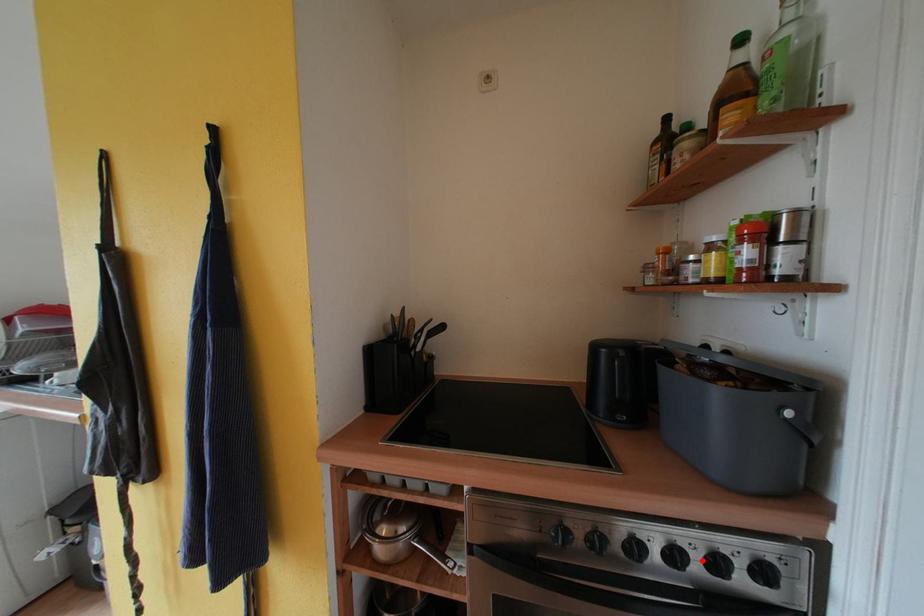
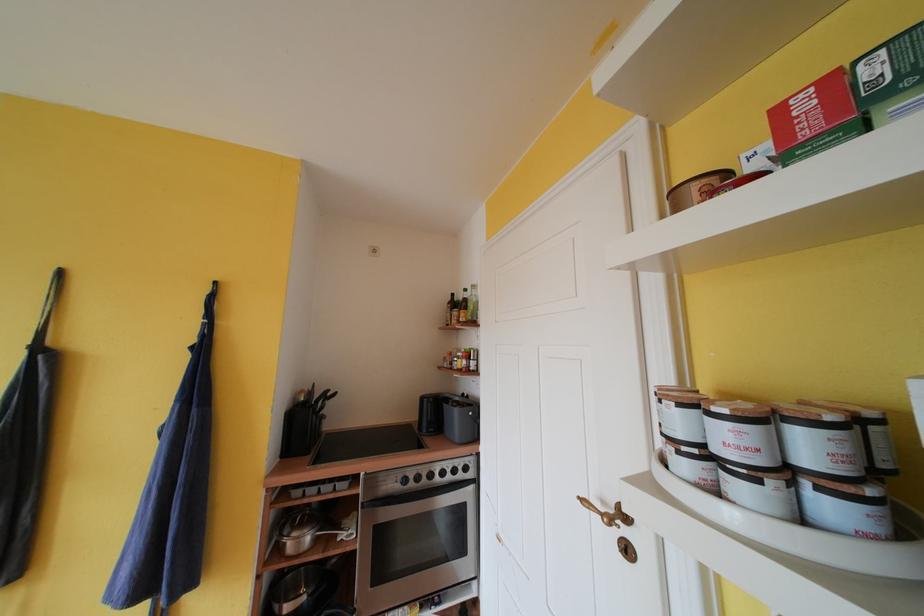
Where in the second image is the point corresponding to the highlighted location from the first image?

(455, 474)